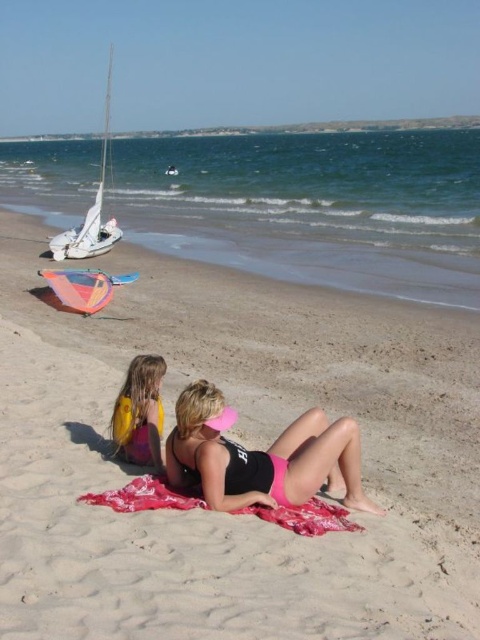
Can you confirm if pink matte swimsuit at center is taller than white sailboat at left?

Incorrect, pink matte swimsuit at center's height is not larger of white sailboat at left's.

I want to click on pink matte swimsuit at center, so click(263, 456).

Image resolution: width=480 pixels, height=640 pixels. Find the location of `pink matte swimsuit at center`. pink matte swimsuit at center is located at coordinates (263, 456).

I want to click on pink matte swimsuit at center, so click(x=263, y=456).

Does sandy beach at center come in front of white sailboat at left?

Yes.

Looking at this image, can you confirm if sandy beach at center is taller than white sailboat at left?

No.

Locate an element on the screen. sandy beach at center is located at coordinates (241, 442).

I want to click on sandy beach at center, so click(241, 442).

Between pink matte swimsuit at center and red woven towel at center, which one is positioned lower?

Positioned lower is red woven towel at center.

Is pink matte swimsuit at center smaller than red woven towel at center?

No.

Is point (280, 435) positioned in front of point (268, 509)?

That is False.

Image resolution: width=480 pixels, height=640 pixels. I want to click on pink matte swimsuit at center, so click(263, 456).